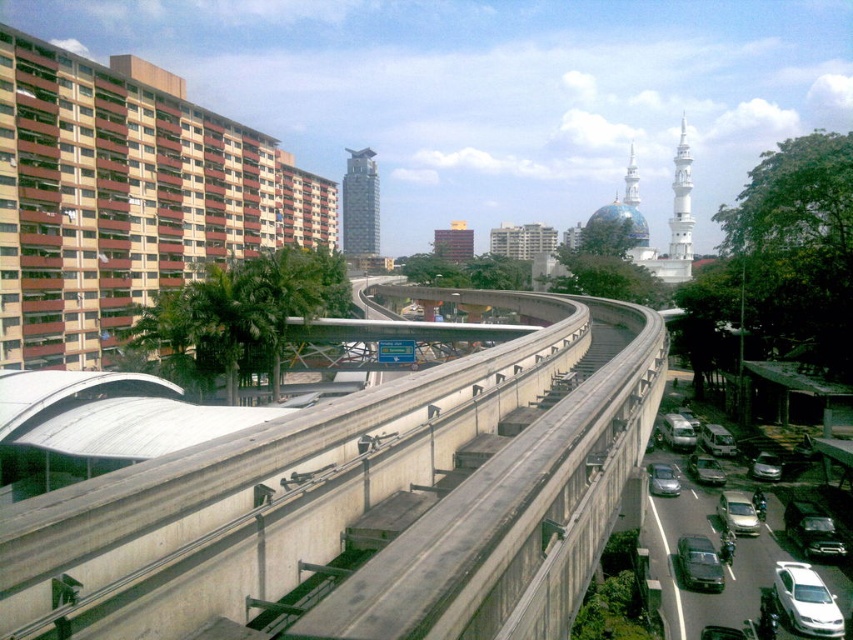
Question: Based on their relative distances, which object is farther from the concrete at center?

Choices:
 (A) satin silver sedan at center-right
 (B) metallic silver car at center-right
 (C) matte black sedan at center
 (D) shiny black car at lower right

Answer: (A)

Question: Which of these objects is positioned closest to the shiny silver sedan at center right?

Choices:
 (A) white matte sedan at lower right
 (B) matte black sedan at center

Answer: (B)

Question: Which point is farther from the camera taking this photo?

Choices:
 (A) (701, 454)
 (B) (712, 548)

Answer: (A)

Question: Is satin black sedan at lower right smaller than metallic silver car at center-right?

Choices:
 (A) no
 (B) yes

Answer: (A)

Question: Does matte black sedan at center appear under satin black sedan at lower right?

Choices:
 (A) no
 (B) yes

Answer: (B)

Question: Can you confirm if white matte sedan at lower right is thinner than metallic silver car at center-right?

Choices:
 (A) yes
 (B) no

Answer: (A)